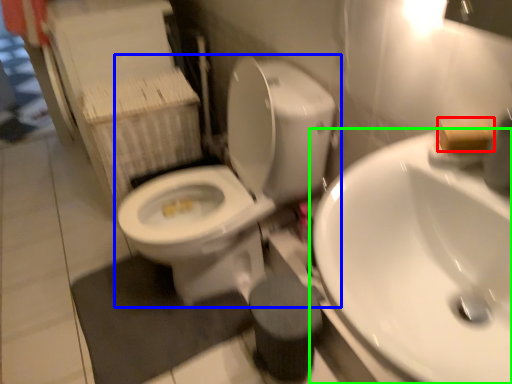
Question: Based on their relative distances, which object is farther from soap (highlighted by a red box)? Choose from toilet (highlighted by a blue box) and sink (highlighted by a green box).

Choices:
 (A) toilet
 (B) sink

Answer: (A)